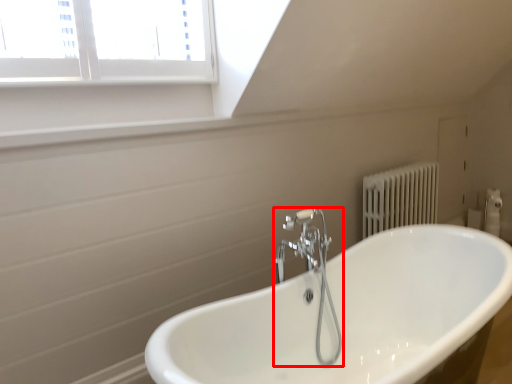
Question: From the image, what is the correct spatial relationship of tap (annotated by the red box) in relation to bathtub?

Choices:
 (A) left
 (B) right

Answer: (A)